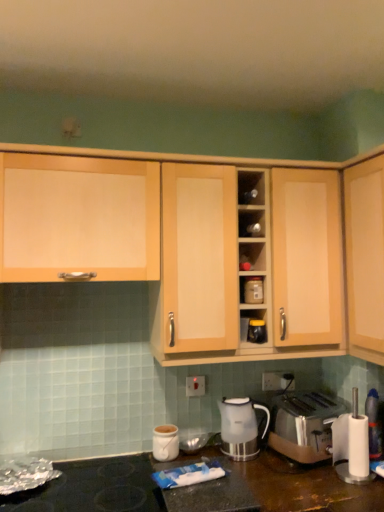
Question: Considering the relative sizes of light wood cabinet at upper right, the 1th cabinetry from the right, and matte plastic container at center, which is counted as the 1th appliance, starting from the top, in the image provided, is light wood cabinet at upper right, the 1th cabinetry from the right, smaller than matte plastic container at center, which is counted as the 1th appliance, starting from the top,?

Choices:
 (A) no
 (B) yes

Answer: (A)

Question: Does light wood cabinet at upper right, the 1th cabinetry from the right, turn towards matte plastic container at center, the 2th appliance when ordered from bottom to top?

Choices:
 (A) yes
 (B) no

Answer: (A)

Question: Is light wood cabinet at upper right, the 1th cabinetry from the right, further to the viewer compared to matte plastic container at center, the 2th appliance when ordered from bottom to top?

Choices:
 (A) yes
 (B) no

Answer: (B)

Question: Can you confirm if light wood cabinet at upper right, the 1th cabinetry from the right, is wider than matte plastic container at center, which is counted as the 1th appliance, starting from the top?

Choices:
 (A) yes
 (B) no

Answer: (A)

Question: From the image's perspective, is light wood cabinet at upper right, the 1th cabinetry from the right, above matte plastic container at center, which is counted as the 1th appliance, starting from the top?

Choices:
 (A) no
 (B) yes

Answer: (B)

Question: Would you say light wood cabinet at upper right, the 1th cabinetry from the right, contains matte plastic container at center, which is counted as the 1th appliance, starting from the top?

Choices:
 (A) yes
 (B) no

Answer: (B)

Question: From a real-world perspective, is metallic silver toaster at center, which ranks as the second appliance in top-to-bottom order, physically below matte plastic container at center, which is counted as the 1th appliance, starting from the top?

Choices:
 (A) yes
 (B) no

Answer: (A)

Question: Is metallic silver toaster at center, the 1th appliance in the bottom-to-top sequence, oriented away from matte plastic container at center, which is counted as the 1th appliance, starting from the top?

Choices:
 (A) no
 (B) yes

Answer: (A)

Question: Can you confirm if metallic silver toaster at center, the 1th appliance in the bottom-to-top sequence, is positioned to the right of matte plastic container at center, the 2th appliance when ordered from bottom to top?

Choices:
 (A) no
 (B) yes

Answer: (B)

Question: Considering the relative sizes of metallic silver toaster at center, which ranks as the second appliance in top-to-bottom order, and matte plastic container at center, which is counted as the 1th appliance, starting from the top, in the image provided, is metallic silver toaster at center, which ranks as the second appliance in top-to-bottom order, wider than matte plastic container at center, which is counted as the 1th appliance, starting from the top,?

Choices:
 (A) yes
 (B) no

Answer: (B)

Question: Does metallic silver toaster at center, which ranks as the second appliance in top-to-bottom order, have a greater height compared to matte plastic container at center, which is counted as the 1th appliance, starting from the top?

Choices:
 (A) no
 (B) yes

Answer: (A)

Question: Is metallic silver toaster at center, the 1th appliance in the bottom-to-top sequence, further to camera compared to matte plastic container at center, the 2th appliance when ordered from bottom to top?

Choices:
 (A) no
 (B) yes

Answer: (A)

Question: Is matte plastic container at center, the 2th appliance when ordered from bottom to top, facing away from satin gold toaster at lower right?

Choices:
 (A) yes
 (B) no

Answer: (B)